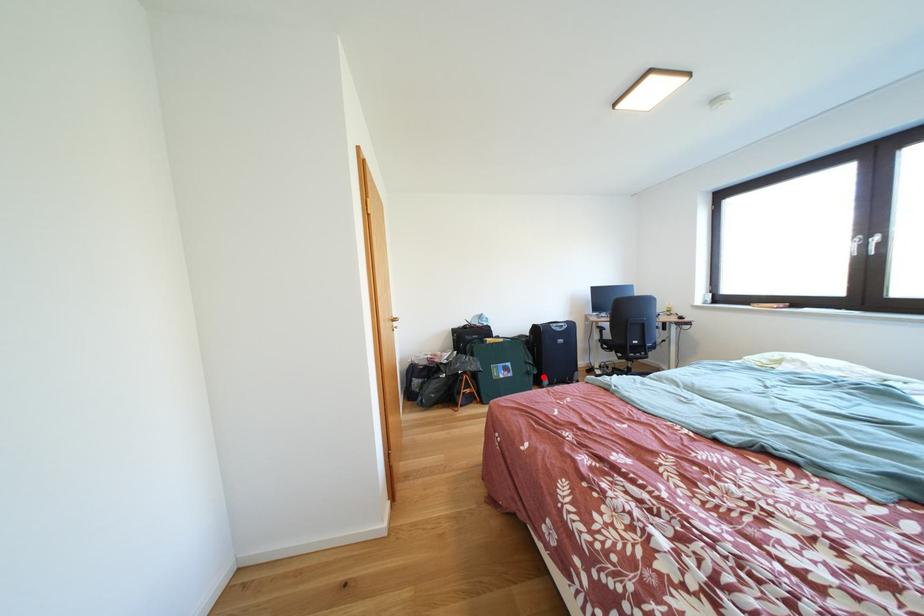
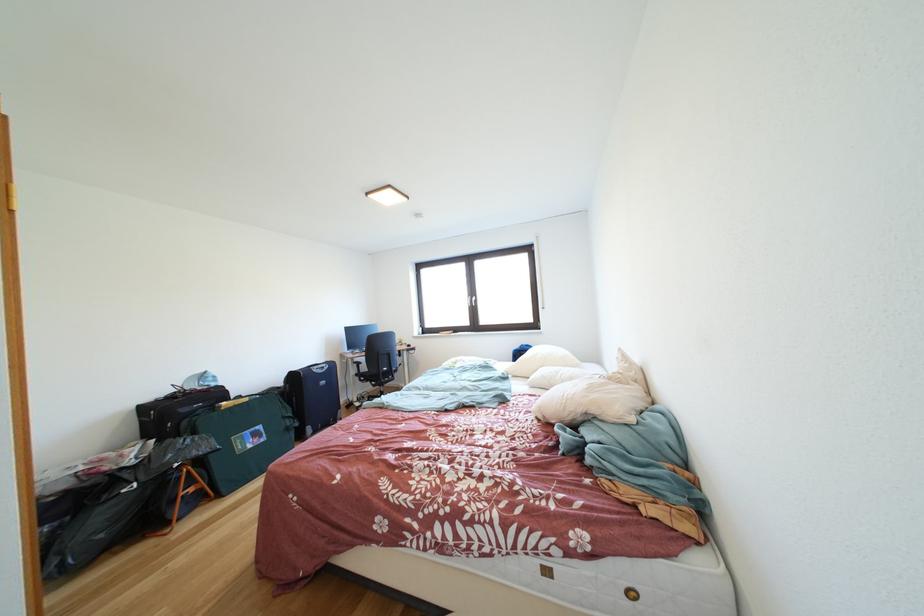
Question: I am providing you with two images of the same scene from different viewpoints. In image1, a red point is highlighted. Considering the same 3D point in image2, which of the following is correct?

Choices:
 (A) It is closer
 (B) It is farther

Answer: (A)